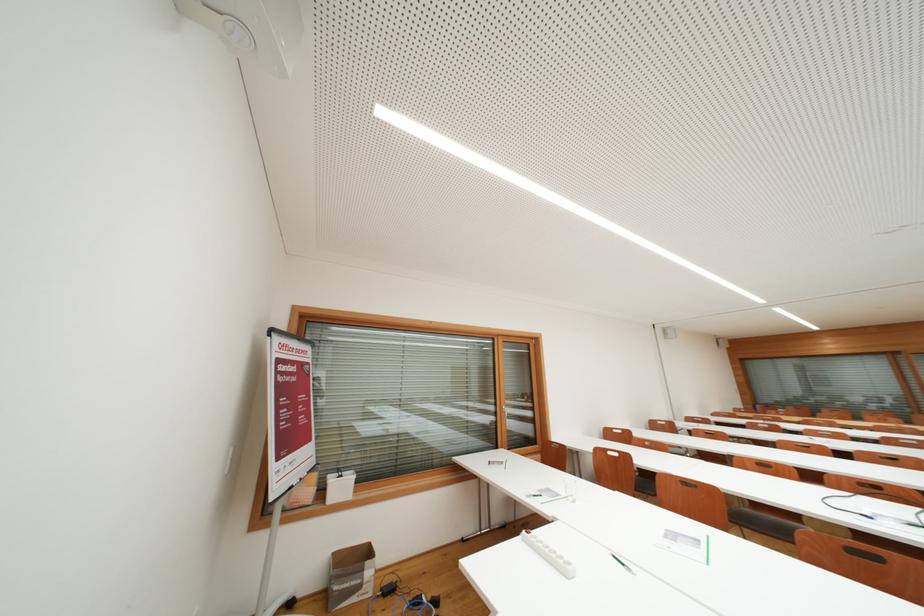
Which object does [549,554] point to?

It corresponds to the white power strip in the image.